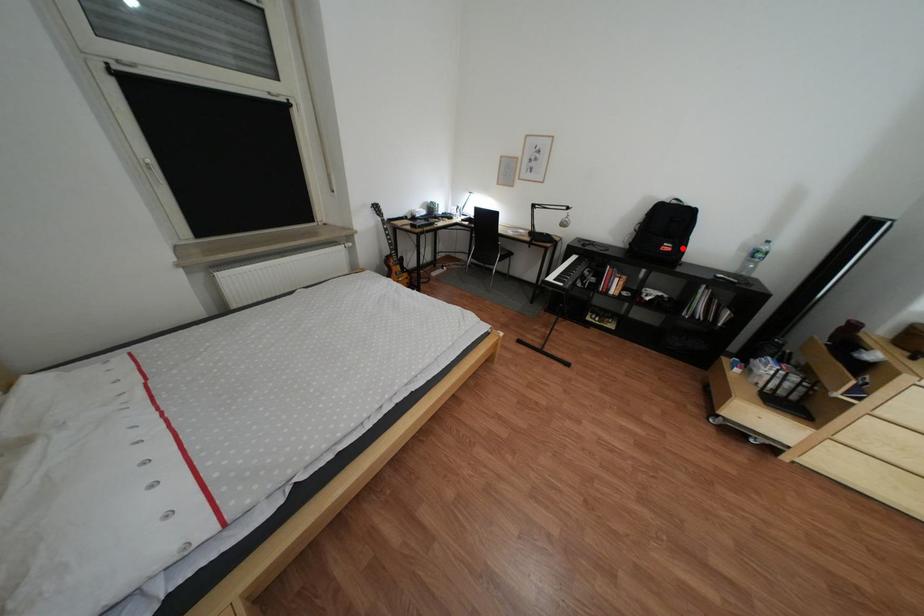
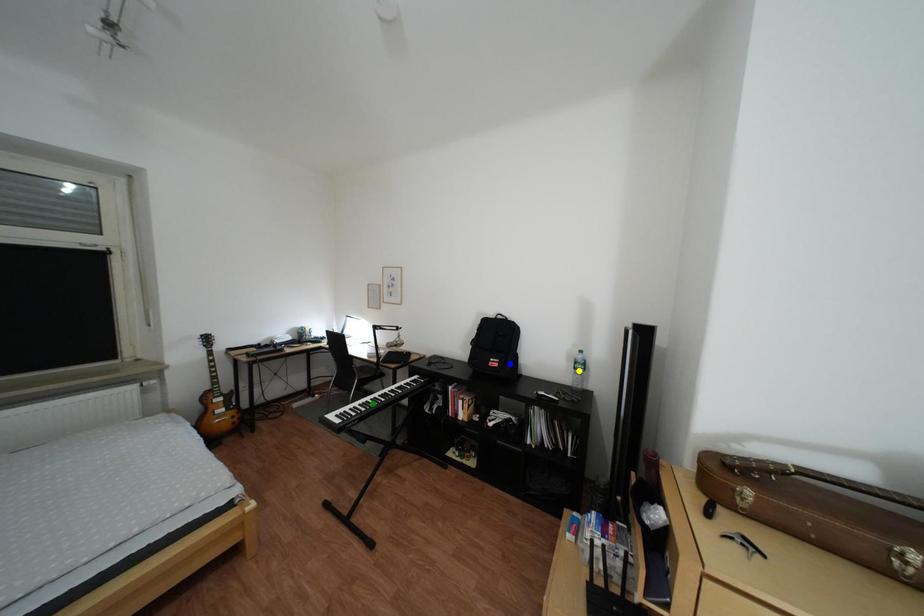
Question: I am providing you with two images of the same scene from different viewpoints. A red point is marked on the first image. You are given multiple points on the second image. In image 2, which mark is for the same physical point as the one in image 1?

Choices:
 (A) blue point
 (B) yellow point
 (C) green point

Answer: (A)